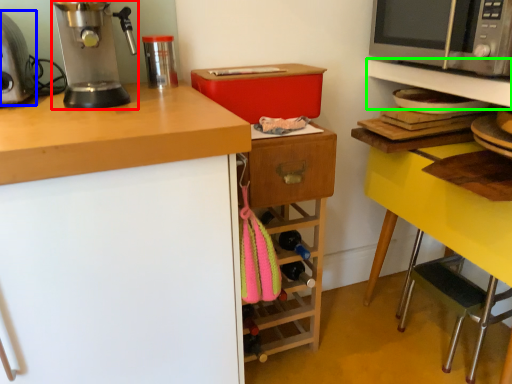
Question: Considering the real-world distances, which object is farthest from home appliance (highlighted by a red box)? kitchen appliance (highlighted by a blue box) or shelf (highlighted by a green box)?

Choices:
 (A) kitchen appliance
 (B) shelf

Answer: (B)